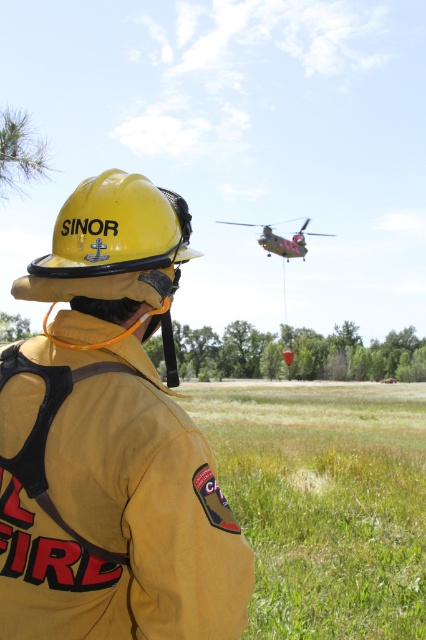
You are a drone operator trying to fly a drone between the yellow matte helmet at center and the green matte helicopter at upper center. The drone has a maximum flight distance of 100 feet. Can the drone safely fly between them without exceeding its range?

The yellow matte helmet at center and the green matte helicopter at upper center are 128.82 feet apart. The drone cannot safely fly between them because the distance exceeds its maximum flight range of 100 feet.

You are standing in the scene and want to determine which of the two points, point (40, 596) or point (129, 296), is nearer to you. Based on the spatial arrangement, which point is closer?

Point (40, 596) is closer to the viewer than point (129, 296).

Based on the photo, you are a photographer trying to capture the firefighter in the image. Since you want to ensure both the yellow fireman at center and the yellow matte helmet at center are clearly visible, which one should you focus on to ensure the larger object is in sharp focus?

The yellow fireman at center is bigger than the yellow matte helmet at center, so you should focus on the yellow fireman at center to ensure the larger object is in sharp focus.